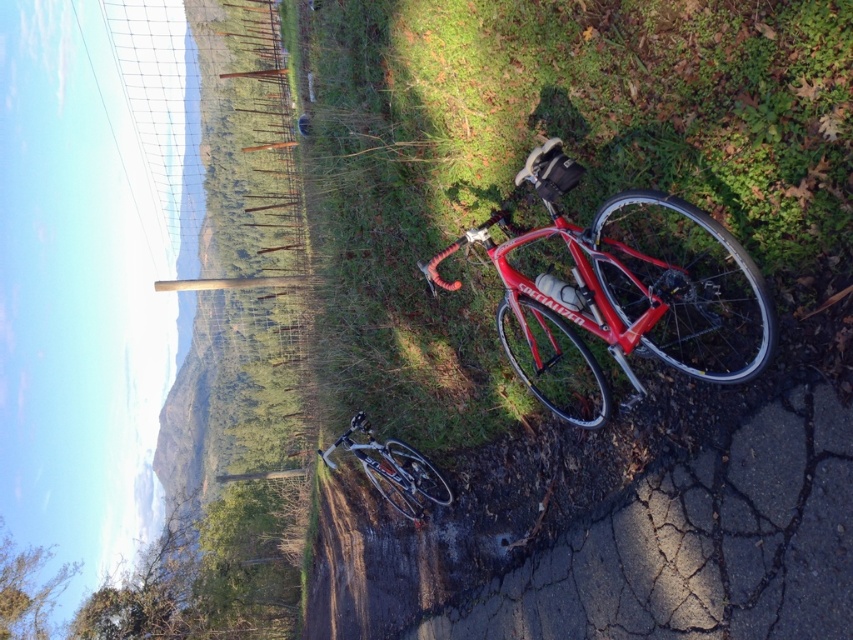
You are a delivery person who needs to choose between the shiny red bicycle at center and the shiny silver bicycle at center to carry heavy packages. Which bicycle would be more stable when carrying heavy loads?

The shiny red bicycle at center has a greater height compared to the shiny silver bicycle at center, which might make it less stable when carrying heavy loads. The shiny silver bicycle at center would likely be more stable due to its lower center of gravity.

You are a photographer planning to capture a wide shot of the scene with both the green grass at center and the shiny red bicycle at center. Given that the camera can only focus on objects within a 10 meter width, will both objects fit within the frame?

The green grass at center is bigger than the shiny red bicycle at center, but the question is about fitting within a 10 meter width. Since the description does not provide specific distances between the objects or their sizes in meters, it is impossible to determine if they will fit within the camera frame based on the given information.

Consider the image. You are a cyclist who just arrived at this rural area and wants to park your bike. You see the green grass at center and the shiny red bicycle at center. Which location would be better to park your bike if you want to avoid the cracked asphalt road?

The green grass at center is to the left of the shiny red bicycle at center, so parking there would keep your bike off the cracked asphalt road.